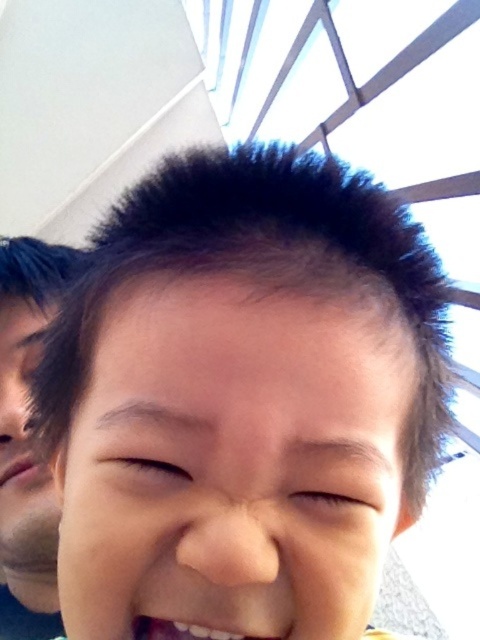
Is point (330, 307) closer to viewer compared to point (12, 632)?

Yes, it is in front of point (12, 632).

Does dark brown hair at center have a lesser width compared to matte black hair at left?

Incorrect, dark brown hair at center's width is not less than matte black hair at left's.

Is point (139, 563) in front of point (31, 497)?

That is True.

The height and width of the screenshot is (640, 480). I want to click on dark brown hair at center, so click(x=242, y=397).

Is dark brown hair at center above pink matte lips at lower left?

Yes.

Does dark brown hair at center have a greater width compared to pink matte lips at lower left?

Correct, the width of dark brown hair at center exceeds that of pink matte lips at lower left.

At what (x,y) coordinates should I click in order to perform the action: click on dark brown hair at center. Please return your answer as a coordinate pair (x, y). The image size is (480, 640). Looking at the image, I should click on (242, 397).

Can you confirm if dark brown hair at center is positioned to the left of smooth skin mouth at center?

Indeed, dark brown hair at center is positioned on the left side of smooth skin mouth at center.

Where is `dark brown hair at center`? dark brown hair at center is located at coordinates (242, 397).

Where is `dark brown hair at center`? The height and width of the screenshot is (640, 480). dark brown hair at center is located at coordinates click(242, 397).